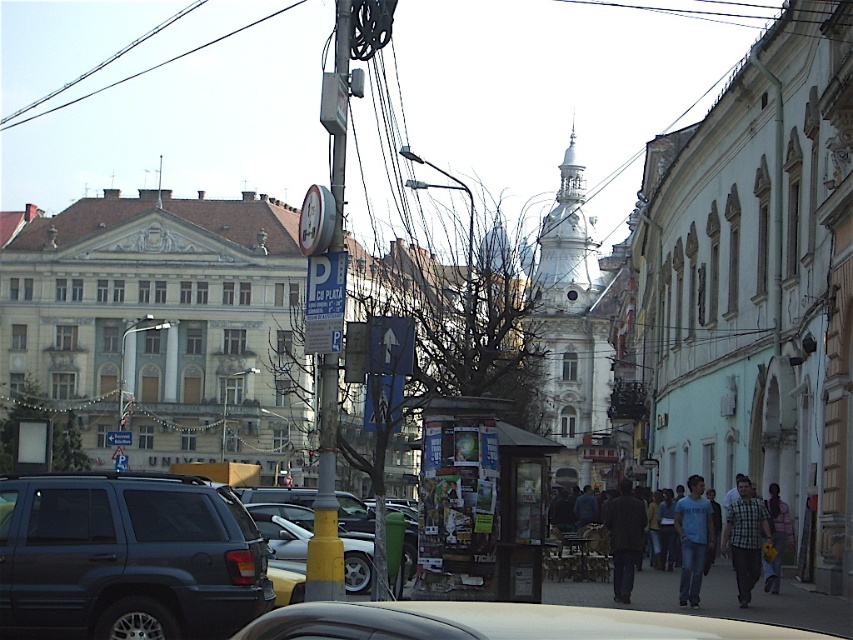
Question: Does matte black car at center appear on the right side of blue cotton shirt at center?

Choices:
 (A) no
 (B) yes

Answer: (A)

Question: From the image, what is the correct spatial relationship of matte black car at center in relation to metallic silver car at center?

Choices:
 (A) below
 (B) above

Answer: (B)

Question: Does paper-covered kiosk at center appear on the right side of dark brown leather jacket at lower center?

Choices:
 (A) yes
 (B) no

Answer: (B)

Question: Which object is farther from the camera taking this photo?

Choices:
 (A) light blue casual shirt at center
 (B) black wire at upper left

Answer: (B)

Question: Which point is farther from the camera taking this photo?

Choices:
 (A) (782, 524)
 (B) (178, 54)
 (C) (267, 500)
 (D) (793, 598)

Answer: (B)

Question: Among these objects, which one is nearest to the camera?

Choices:
 (A) dark brown leather jacket at lower center
 (B) checkered fabric shirt at center
 (C) plaid shirt at lower right

Answer: (B)